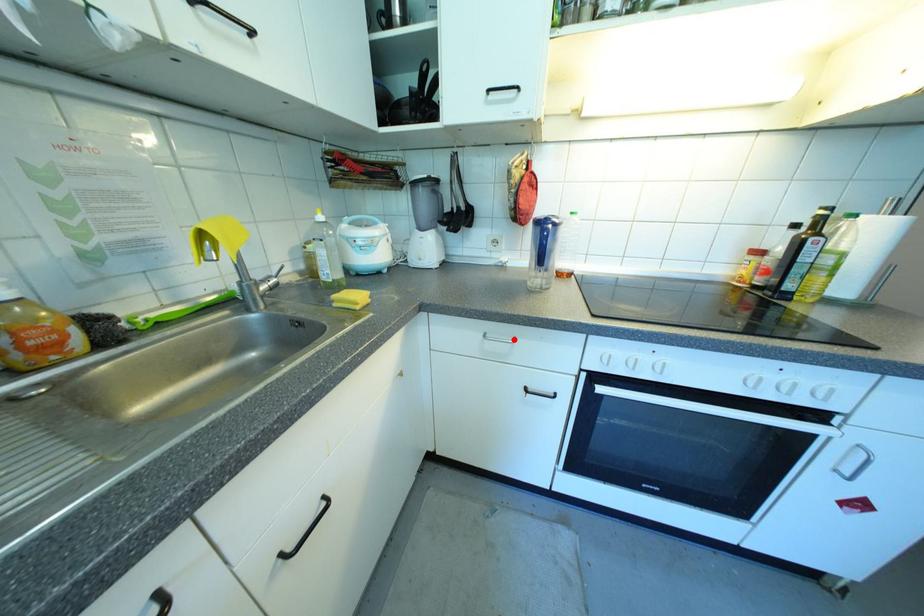
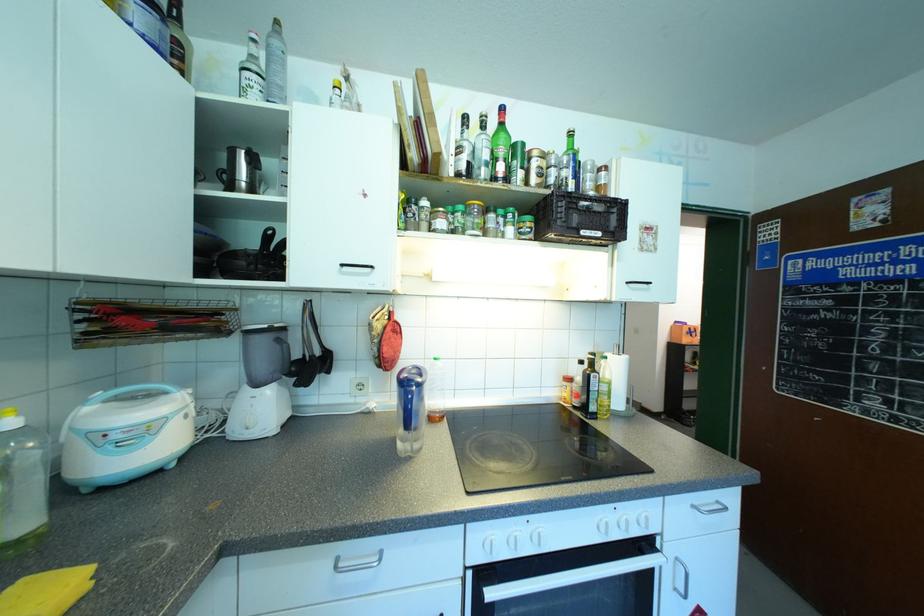
Question: I am providing you with two images of the same scene from different viewpoints. A red point is marked on the first image. Is the red point's position out of view in image 2?

Choices:
 (A) Yes
 (B) No

Answer: (B)